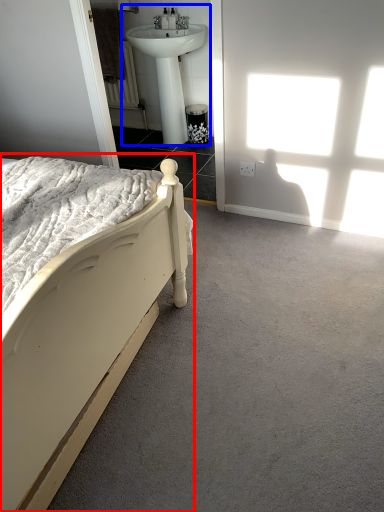
Question: Which object is closer to the camera taking this photo, bed (highlighted by a red box) or sink (highlighted by a blue box)?

Choices:
 (A) bed
 (B) sink

Answer: (A)